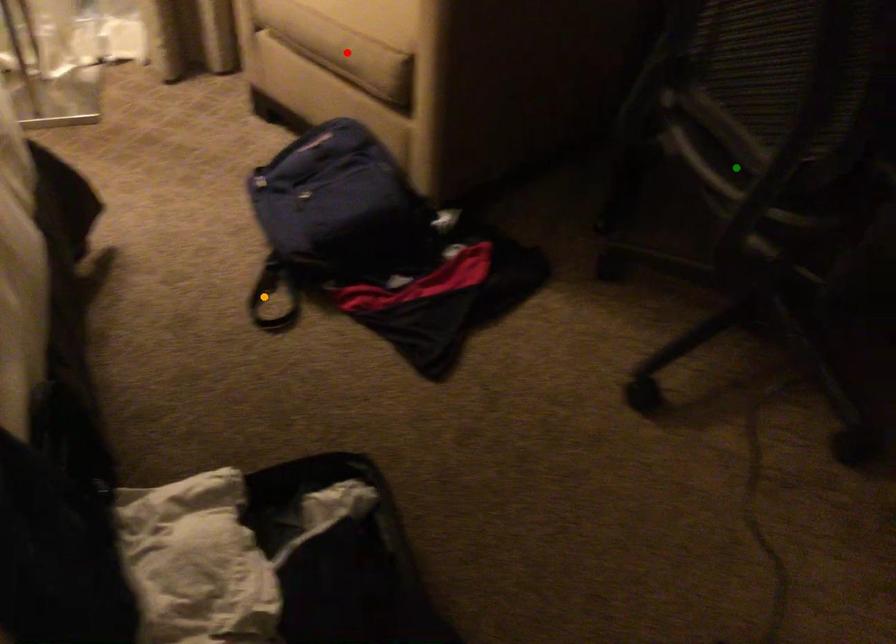
Order these from nearest to farthest:
green point
red point
orange point

green point < orange point < red point